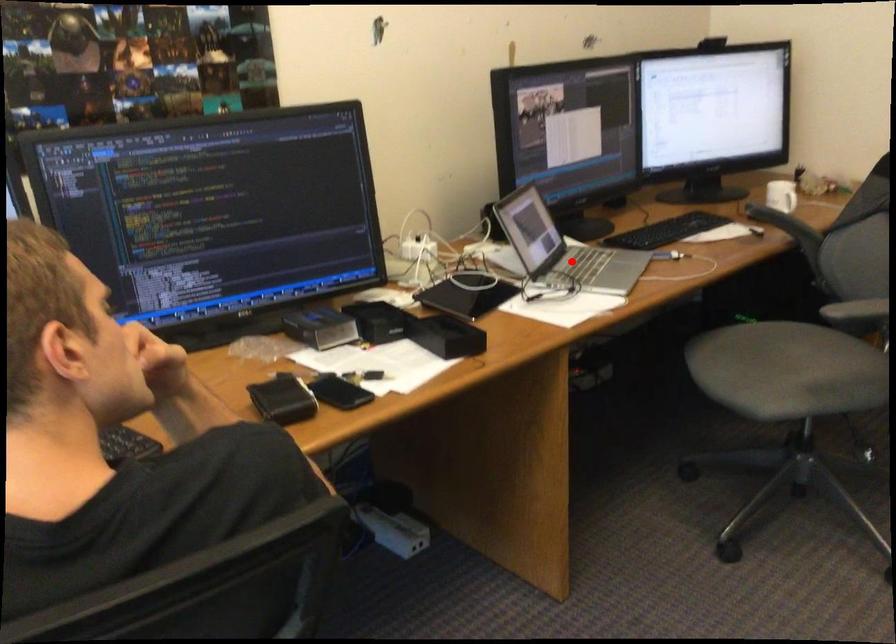
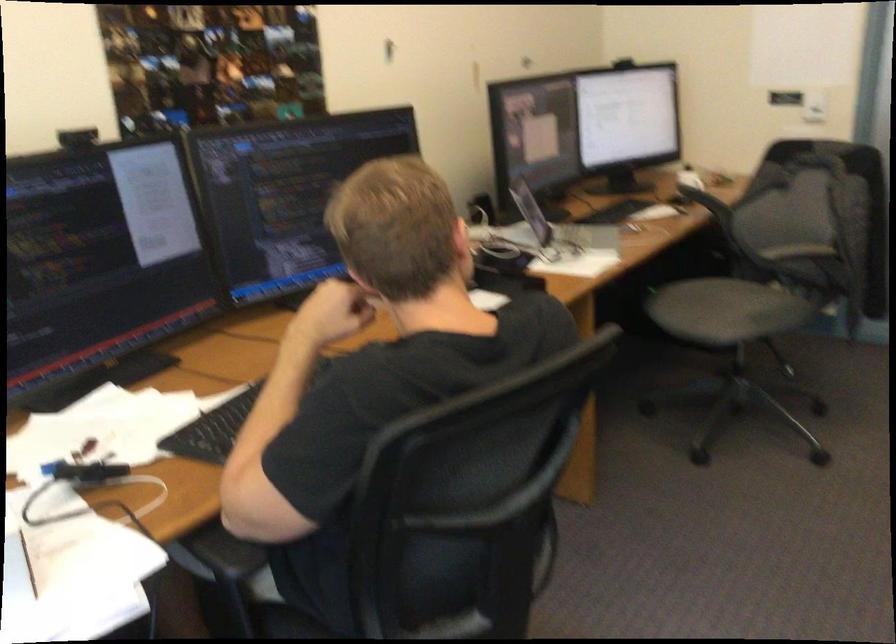
Where in the second image is the point corresponding to the highlighted location from the first image?

(561, 230)